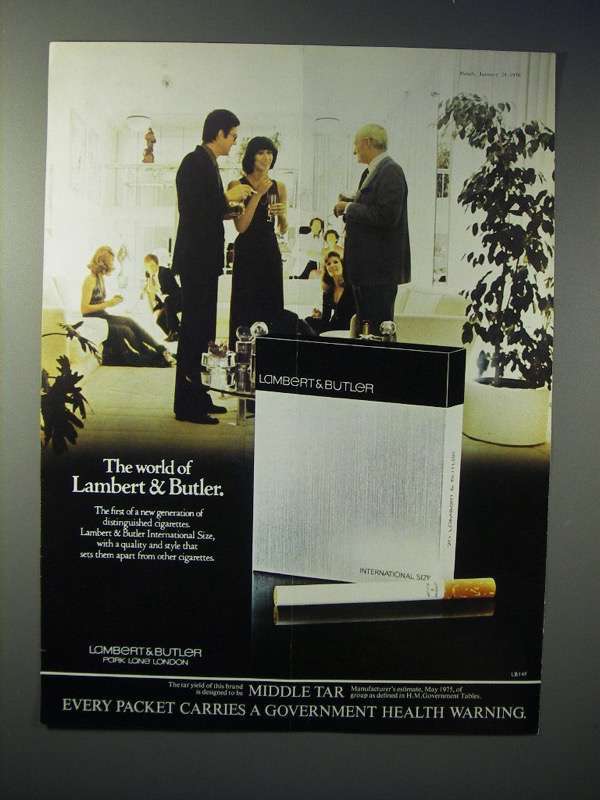
Find the location of a particular element. figurine is located at coordinates (151, 137).